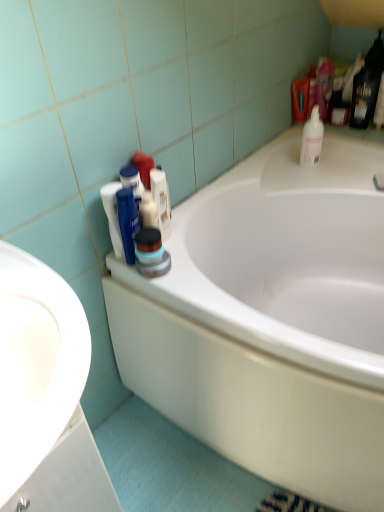
What is the approximate height of white glossy sink at left?

white glossy sink at left is 6.98 inches in height.

This screenshot has height=512, width=384. Describe the element at coordinates (36, 362) in the screenshot. I see `white glossy sink at left` at that location.

Image resolution: width=384 pixels, height=512 pixels. What do you see at coordinates (271, 320) in the screenshot?
I see `white glossy bathtub at center` at bounding box center [271, 320].

I want to click on white plastic bottle at upper right, which is the 2th cleaning product in bottom-to-top order, so click(x=312, y=139).

This screenshot has width=384, height=512. I want to click on matte black container at center, the 1th cleaning product in the front-to-back sequence, so click(x=151, y=253).

You are a GUI agent. You are given a task and a screenshot of the screen. Output one action in this format:
    pyautogui.click(x=<x>, y=<y>)
    Task: Click on the white glossy sink at left
    
    Given the screenshot: What is the action you would take?
    pyautogui.click(x=36, y=362)

Considering the relative sizes of white matte shaving cream at upper center and matte black container at center, the first cleaning product in the bottom-to-top sequence, in the image provided, is white matte shaving cream at upper center bigger than matte black container at center, the first cleaning product in the bottom-to-top sequence,?

No, white matte shaving cream at upper center is not bigger than matte black container at center, the first cleaning product in the bottom-to-top sequence.

Does point (151, 170) lie in front of point (146, 269)?

No, (151, 170) is further to viewer.

This screenshot has width=384, height=512. In order to click on toiletry that appears above the matte black container at center, arranged as the second cleaning product when viewed from the right (from the image's perspective) in this screenshot , I will do `click(161, 200)`.

From the picture: Which of these two, white matte shaving cream at upper center or matte black container at center, the first cleaning product in the bottom-to-top sequence, stands taller?

Standing taller between the two is white matte shaving cream at upper center.

Which is more to the right, white glossy bathtub at center or matte black container at center, arranged as the second cleaning product when viewed from the right?

From the viewer's perspective, white glossy bathtub at center appears more on the right side.

From the picture: Considering the relative sizes of white glossy bathtub at center and matte black container at center, the first cleaning product positioned from the left, in the image provided, is white glossy bathtub at center smaller than matte black container at center, the first cleaning product positioned from the left,?

No.

Considering the sizes of objects white glossy bathtub at center and matte black container at center, placed as the second cleaning product when sorted from back to front, in the image provided, who is shorter, white glossy bathtub at center or matte black container at center, placed as the second cleaning product when sorted from back to front,?

matte black container at center, placed as the second cleaning product when sorted from back to front, is shorter.

Is white glossy bathtub at center touching matte black container at center, arranged as the second cleaning product when viewed from the right?

No, white glossy bathtub at center is not with matte black container at center, arranged as the second cleaning product when viewed from the right.

Considering the relative sizes of white matte shaving cream at upper center and white glossy sink at left in the image provided, is white matte shaving cream at upper center thinner than white glossy sink at left?

Indeed, white matte shaving cream at upper center has a lesser width compared to white glossy sink at left.

Considering the points (150, 187) and (9, 468), which point is behind, point (150, 187) or point (9, 468)?

The point (150, 187) is more distant.

Does white matte shaving cream at upper center appear on the left side of white glossy sink at left?

Incorrect, white matte shaving cream at upper center is not on the left side of white glossy sink at left.

Can you confirm if white glossy bathtub at center is thinner than white glossy sink at left?

In fact, white glossy bathtub at center might be wider than white glossy sink at left.

In terms of size, does white glossy bathtub at center appear bigger or smaller than white glossy sink at left?

Considering their sizes, white glossy bathtub at center takes up more space than white glossy sink at left.

How many degrees apart are the facing directions of white glossy bathtub at center and white glossy sink at left?

The facing directions of white glossy bathtub at center and white glossy sink at left are 90.5 degrees apart.

Considering the positions of objects white plastic bottle at upper right, which is the first cleaning product from top to bottom, and white matte shaving cream at upper center in the image provided, who is in front, white plastic bottle at upper right, which is the first cleaning product from top to bottom, or white matte shaving cream at upper center?

white matte shaving cream at upper center is more forward.

Consider the image. Which object is wider, white plastic bottle at upper right, which is the first cleaning product from top to bottom, or white matte shaving cream at upper center?

white plastic bottle at upper right, which is the first cleaning product from top to bottom, is wider.

Looking at this image, are white plastic bottle at upper right, acting as the 1th cleaning product starting from the right, and white matte shaving cream at upper center far apart?

No, white plastic bottle at upper right, acting as the 1th cleaning product starting from the right, is not far from white matte shaving cream at upper center.

Considering the relative sizes of white plastic bottle at upper right, acting as the 1th cleaning product starting from the right, and white matte shaving cream at upper center in the image provided, is white plastic bottle at upper right, acting as the 1th cleaning product starting from the right, taller than white matte shaving cream at upper center?

Correct, white plastic bottle at upper right, acting as the 1th cleaning product starting from the right, is much taller as white matte shaving cream at upper center.

Is white plastic bottle at upper right, arranged as the first cleaning product when viewed from the back, not near matte black container at center, arranged as the second cleaning product when viewed from the right?

No, white plastic bottle at upper right, arranged as the first cleaning product when viewed from the back, is not far away from matte black container at center, arranged as the second cleaning product when viewed from the right.

From a real-world perspective, is white plastic bottle at upper right, acting as the 1th cleaning product starting from the right, positioned above or below matte black container at center, placed as the second cleaning product when sorted from back to front?

Clearly, from a real-world perspective, white plastic bottle at upper right, acting as the 1th cleaning product starting from the right, is below matte black container at center, placed as the second cleaning product when sorted from back to front.

Is point (319, 125) less distant than point (137, 269)?

No, (319, 125) is behind (137, 269).

From the image's perspective, is white glossy sink at left located above white matte shaving cream at upper center?

No, from the image's perspective, white glossy sink at left is not on top of white matte shaving cream at upper center.

Is white glossy sink at left closer to the viewer compared to white matte shaving cream at upper center?

Yes, it is.

Where is `toiletry that appears on the right of white glossy sink at left`? toiletry that appears on the right of white glossy sink at left is located at coordinates (x=161, y=200).

Considering the sizes of objects white glossy sink at left and white matte shaving cream at upper center in the image provided, who is smaller, white glossy sink at left or white matte shaving cream at upper center?

Smaller between the two is white matte shaving cream at upper center.

Identify the location of cleaning product below the white matte shaving cream at upper center (from the image's perspective). The image size is (384, 512). (151, 253).

Find the location of a particular element. bathtub directly beneath the matte black container at center, placed as the second cleaning product when sorted from back to front (from a real-world perspective) is located at coordinates (271, 320).

From the image, which object appears to be nearer to white plastic bottle at upper right, which is counted as the second cleaning product, starting from the front, white glossy bathtub at center or white glossy sink at left?

white glossy bathtub at center is positioned closer to the anchor white plastic bottle at upper right, which is counted as the second cleaning product, starting from the front.

Which object lies nearer to the anchor point matte black container at center, the first cleaning product positioned from the left, white plastic bottle at upper right, arranged as the first cleaning product when viewed from the back, or white glossy sink at left?

Among the two, white glossy sink at left is located nearer to matte black container at center, the first cleaning product positioned from the left.

Looking at the image, which one is located further to matte black container at center, the 1th cleaning product in the front-to-back sequence, white plastic bottle at upper right, the 2th cleaning product viewed from the left, or white matte shaving cream at upper center?

Among the two, white plastic bottle at upper right, the 2th cleaning product viewed from the left, is located further to matte black container at center, the 1th cleaning product in the front-to-back sequence.

From the picture: From the image, which object appears to be nearer to white matte shaving cream at upper center, white glossy bathtub at center or white glossy sink at left?

white glossy bathtub at center.

When comparing their distances from white glossy bathtub at center, does matte black container at center, the 1th cleaning product in the front-to-back sequence, or white plastic bottle at upper right, which is the 2th cleaning product in bottom-to-top order, seem further?

white plastic bottle at upper right, which is the 2th cleaning product in bottom-to-top order, lies further to white glossy bathtub at center than the other object.

Considering their positions, is white glossy bathtub at center positioned closer to white plastic bottle at upper right, the 2th cleaning product viewed from the left, than white matte shaving cream at upper center?

white glossy bathtub at center is positioned closer to the anchor white plastic bottle at upper right, the 2th cleaning product viewed from the left.

Based on the photo, which object lies nearer to the anchor point white matte shaving cream at upper center, matte black container at center, arranged as the second cleaning product when viewed from the right, or white plastic bottle at upper right, which is the first cleaning product from top to bottom?

matte black container at center, arranged as the second cleaning product when viewed from the right, lies closer to white matte shaving cream at upper center than the other object.

Estimate the real-world distances between objects in this image. Which object is further from white glossy bathtub at center, matte black container at center, arranged as the second cleaning product when viewed from the right, or white matte shaving cream at upper center?

matte black container at center, arranged as the second cleaning product when viewed from the right, is further to white glossy bathtub at center.

The height and width of the screenshot is (512, 384). I want to click on cleaning product located between white glossy sink at left and white matte shaving cream at upper center in the depth direction, so click(x=151, y=253).

Locate an element on the screen. toiletry located between white glossy sink at left and white glossy bathtub at center in the left-right direction is located at coordinates (161, 200).

Locate an element on the screen. toiletry between white glossy bathtub at center and white plastic bottle at upper right, which is the first cleaning product from top to bottom, in the front-back direction is located at coordinates coord(161,200).

This screenshot has height=512, width=384. In order to click on cleaning product positioned between white glossy bathtub at center and white plastic bottle at upper right, which is counted as the second cleaning product, starting from the front, from near to far in this screenshot , I will do `click(151, 253)`.